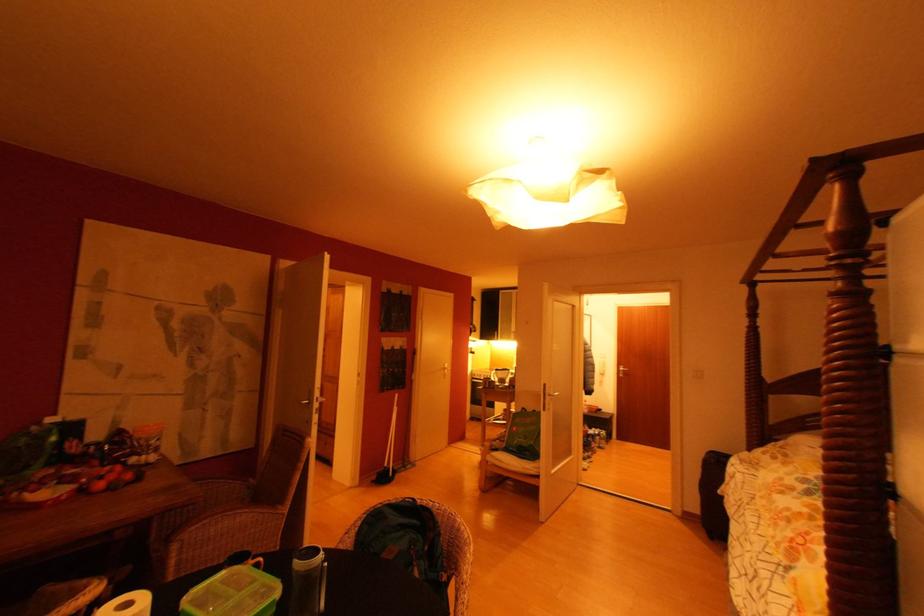
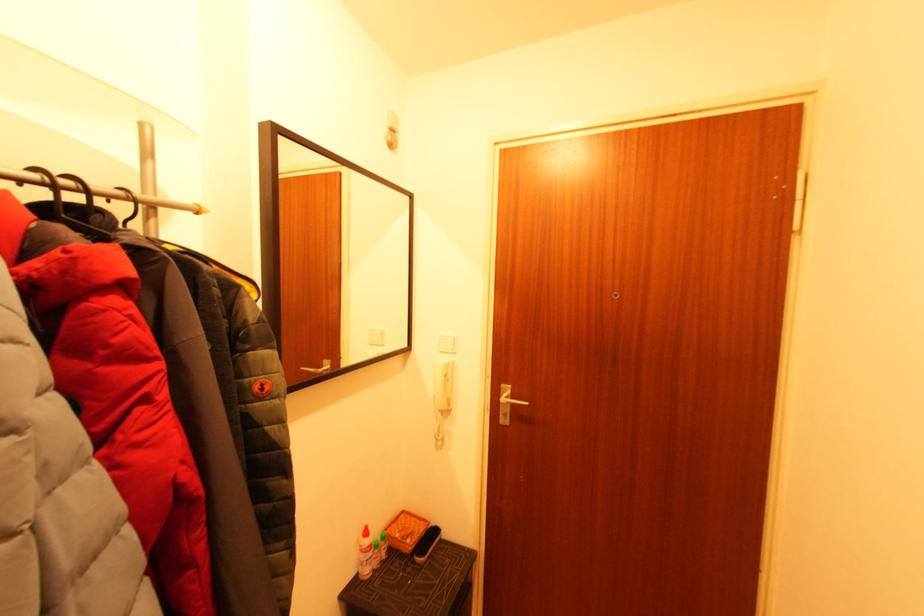
The point at (590, 403) is marked in the first image. Where is the corresponding point in the second image?

(371, 535)